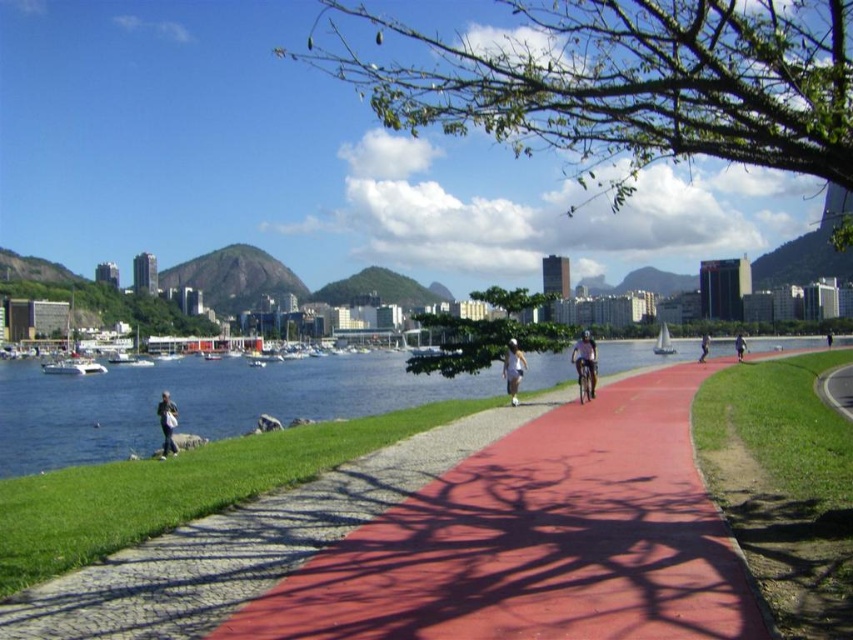
You are a tourist standing on the shiny red pavement at center and want to take a photo of the white glossy boat at lower left. Which direction should you face to capture the boat in your shot?

The white glossy boat at lower left is positioned on the left side of the shiny red pavement at center. Therefore, you should face to the left to capture the boat in your shot.

You are standing at the edge of the shiny red pavement at center and want to reach the dark blue jeans at lower right. Which direction should you move to get there?

You should move downward because the shiny red pavement at center is located above the dark blue jeans at lower right.